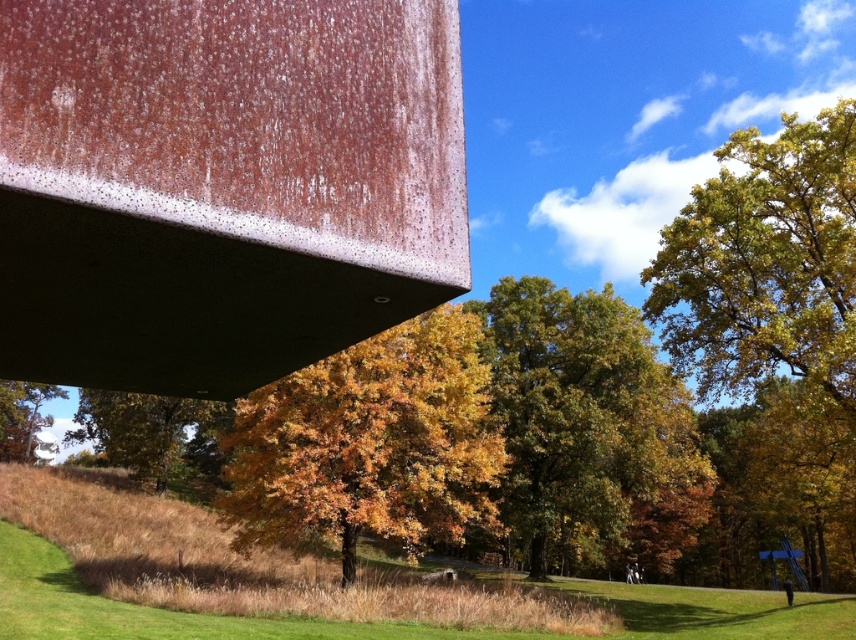
Based on the photo, does yellow-green leaves at center lie in front of green matte tree at lower left?

Yes, it is in front of green matte tree at lower left.

Is point (125, 452) more distant than point (18, 401)?

No, (125, 452) is closer to viewer.

Identify the location of yellow-green leaves at center. This screenshot has height=640, width=856. (153, 435).

Is yellow-orange leaves at center taller than golden yellow leaves at center?

No.

In the scene shown: Does yellow-orange leaves at center have a smaller size compared to golden yellow leaves at center?

Indeed, yellow-orange leaves at center has a smaller size compared to golden yellow leaves at center.

What do you see at coordinates (369, 444) in the screenshot?
I see `yellow-orange leaves at center` at bounding box center [369, 444].

Image resolution: width=856 pixels, height=640 pixels. In order to click on yellow-orange leaves at center in this screenshot , I will do `click(369, 444)`.

Which is more to the right, golden yellow leaves at right or yellow-green leaves at center?

From the viewer's perspective, golden yellow leaves at right appears more on the right side.

Does point (746, 282) come in front of point (210, 410)?

Yes, point (746, 282) is closer to viewer.

The height and width of the screenshot is (640, 856). What do you see at coordinates (771, 337) in the screenshot? I see `golden yellow leaves at right` at bounding box center [771, 337].

The height and width of the screenshot is (640, 856). In order to click on golden yellow leaves at right in this screenshot , I will do `click(771, 337)`.